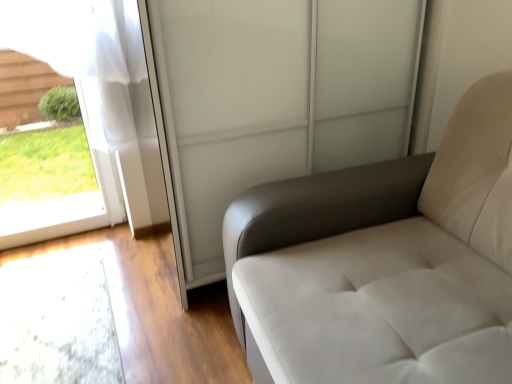
Question: Considering the relative positions of clear glass window at left and transparent glass screen door at upper center in the image provided, is clear glass window at left to the left of transparent glass screen door at upper center from the viewer's perspective?

Choices:
 (A) no
 (B) yes

Answer: (B)

Question: Considering the relative positions of clear glass window at left and transparent glass screen door at upper center in the image provided, is clear glass window at left to the right of transparent glass screen door at upper center from the viewer's perspective?

Choices:
 (A) yes
 (B) no

Answer: (B)

Question: Is clear glass window at left next to transparent glass screen door at upper center?

Choices:
 (A) yes
 (B) no

Answer: (B)

Question: Can transparent glass screen door at upper center be found inside clear glass window at left?

Choices:
 (A) no
 (B) yes

Answer: (A)

Question: Is clear glass window at left further to the viewer compared to transparent glass screen door at upper center?

Choices:
 (A) yes
 (B) no

Answer: (A)

Question: Considering the relative sizes of clear glass window at left and transparent glass screen door at upper center in the image provided, is clear glass window at left bigger than transparent glass screen door at upper center?

Choices:
 (A) no
 (B) yes

Answer: (A)

Question: Is white leather armchair at right a part of clear glass window at left?

Choices:
 (A) no
 (B) yes

Answer: (A)

Question: From the image's perspective, would you say clear glass window at left is positioned over white leather armchair at right?

Choices:
 (A) no
 (B) yes

Answer: (B)

Question: Is clear glass window at left facing towards white leather armchair at right?

Choices:
 (A) yes
 (B) no

Answer: (B)

Question: Is clear glass window at left placed right next to white leather armchair at right?

Choices:
 (A) yes
 (B) no

Answer: (B)

Question: Is clear glass window at left not close to white leather armchair at right?

Choices:
 (A) yes
 (B) no

Answer: (A)

Question: Can you confirm if clear glass window at left is positioned to the left of white leather armchair at right?

Choices:
 (A) yes
 (B) no

Answer: (A)

Question: Could you tell me if white leather armchair at right is facing transparent glass screen door at upper center?

Choices:
 (A) no
 (B) yes

Answer: (A)